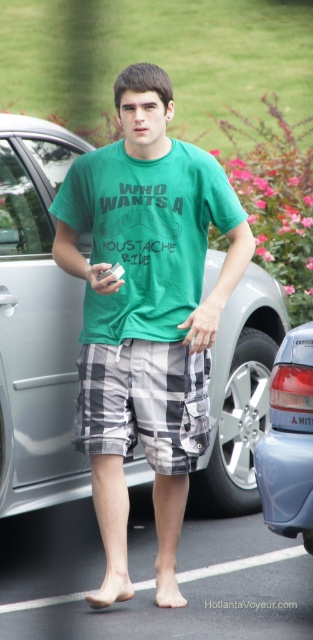
This screenshot has height=640, width=313. Describe the element at coordinates (145, 234) in the screenshot. I see `green cotton t-shirt at center` at that location.

Locate an element on the screen. green cotton t-shirt at center is located at coordinates (145, 234).

Is silver metallic car at center positioned at the back of blue metallic sedan at right?

That is True.

Between silver metallic car at center and blue metallic sedan at right, which one has less height?

blue metallic sedan at right

Which is behind, point (241, 486) or point (307, 355)?

Point (241, 486)

The image size is (313, 640). What are the coordinates of `silver metallic car at center` in the screenshot? It's located at (35, 323).

The image size is (313, 640). In order to click on silver metallic car at center in this screenshot , I will do `click(35, 323)`.

Where is `silver metallic car at center`? The height and width of the screenshot is (640, 313). silver metallic car at center is located at coordinates pos(35,323).